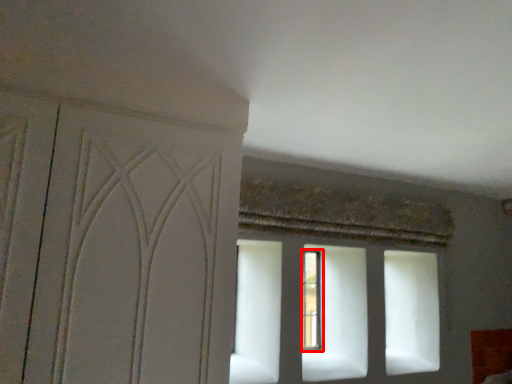
Question: In this image, where is window (annotated by the red box) located relative to screen door?

Choices:
 (A) left
 (B) right

Answer: (B)